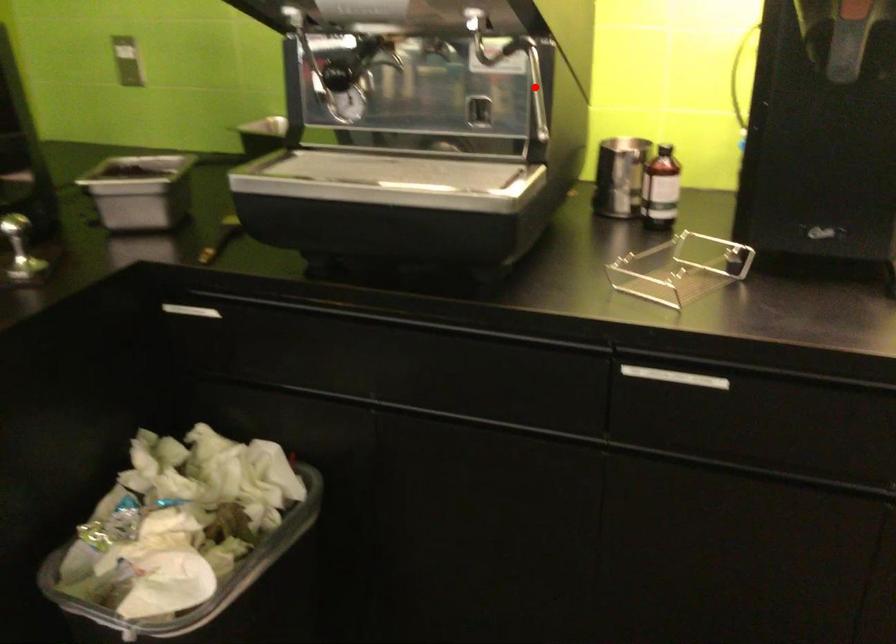
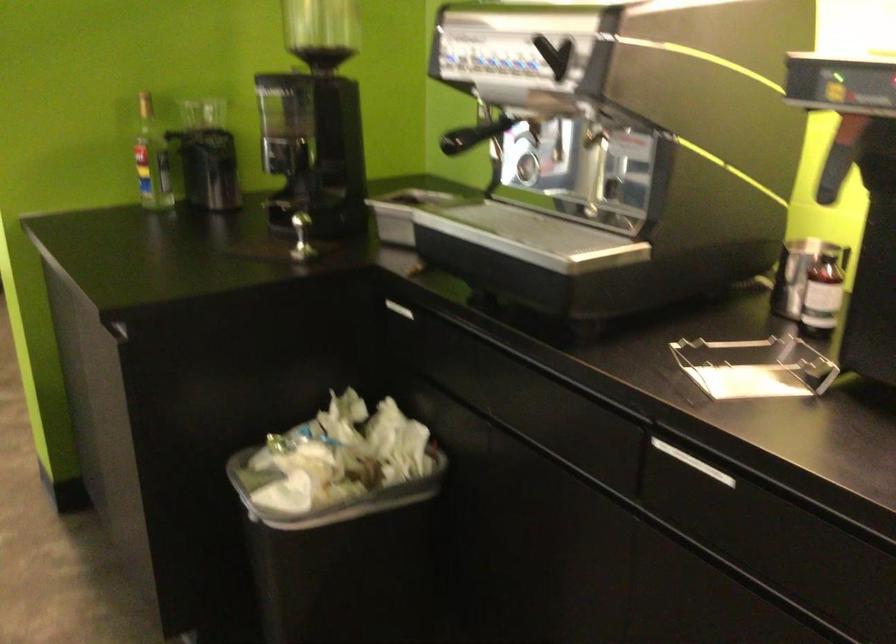
Question: I am providing you with two images of the same scene from different viewpoints. A red point is marked on the first image. Can you still see the location of the red point in image 2?

Choices:
 (A) Yes
 (B) No

Answer: (A)